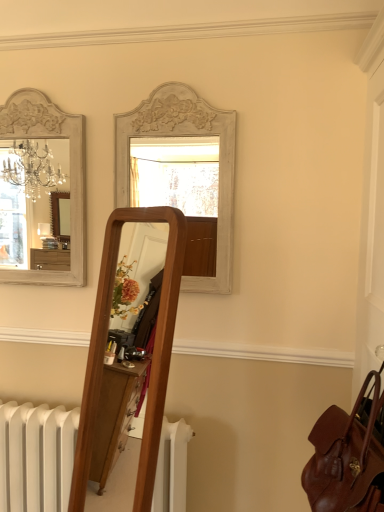
Question: Considering the positions of point (223, 253) and point (377, 399), is point (223, 253) closer or farther from the camera than point (377, 399)?

Choices:
 (A) farther
 (B) closer

Answer: (A)

Question: In terms of width, does white painted wood mirror at upper center, positioned as the 2th mirror in left-to-right order, look wider or thinner when compared to leather at right?

Choices:
 (A) wide
 (B) thin

Answer: (B)

Question: Estimate the real-world distances between objects in this image. Which object is closer to the white painted wood mirror at upper left, the 2th mirror from the right?

Choices:
 (A) leather at right
 (B) white painted wood mirror at upper center, which is counted as the first mirror, starting from the right

Answer: (B)

Question: Which is nearer to the leather at right?

Choices:
 (A) white painted wood mirror at upper center, positioned as the 2th mirror in left-to-right order
 (B) white painted wood mirror at upper left, which is counted as the 1th mirror, starting from the left

Answer: (A)